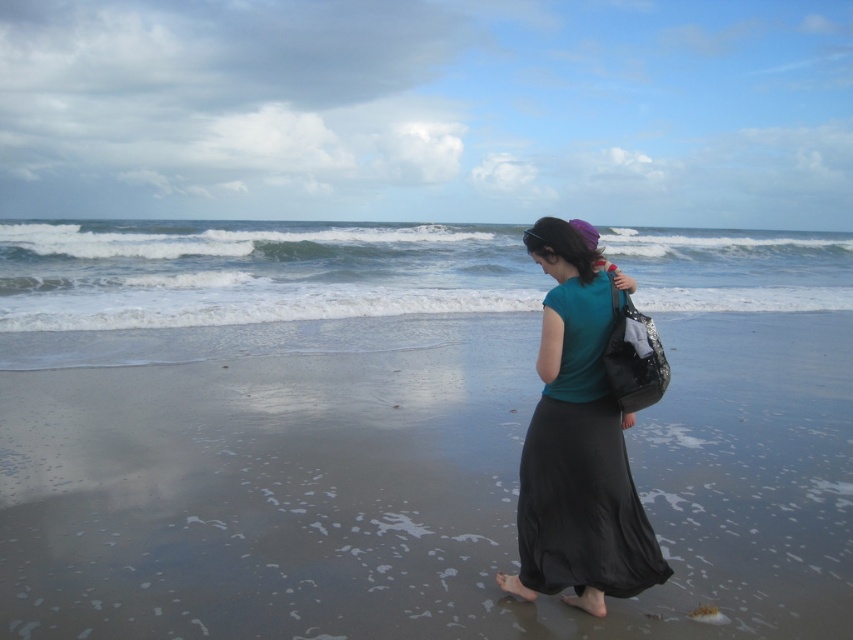
Question: Is smooth sand at lower center positioned in front of white foamy water at center?

Choices:
 (A) no
 (B) yes

Answer: (B)

Question: Which point is closer to the camera taking this photo?

Choices:
 (A) (202, 285)
 (B) (532, 509)
 (C) (804, 628)

Answer: (C)

Question: Can you confirm if smooth sand at lower center is positioned below teal fabric shirt at center?

Choices:
 (A) yes
 (B) no

Answer: (A)

Question: Can you confirm if white foamy water at center is positioned to the left of teal fabric shirt at center?

Choices:
 (A) yes
 (B) no

Answer: (A)

Question: Which object is the farthest from the smooth sand at lower center?

Choices:
 (A) white foamy water at center
 (B) teal fabric shirt at center

Answer: (A)

Question: Which of the following is the closest to the observer?

Choices:
 (A) smooth sand at lower center
 (B) white foamy water at center
 (C) teal fabric shirt at center

Answer: (C)